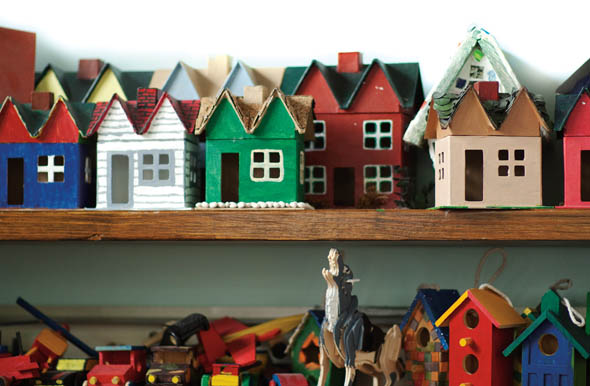
Identify the location of lights. The height and width of the screenshot is (386, 590). (176, 381), (150, 376), (114, 381), (90, 381).